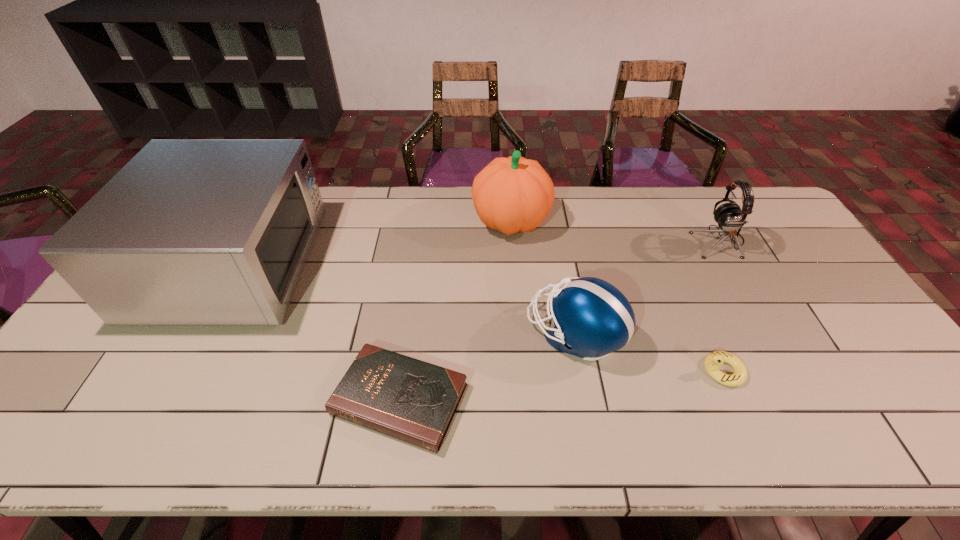
The height and width of the screenshot is (540, 960). What are the coordinates of `vacant area that lies between the second object from left to right and the football helmet` in the screenshot? It's located at (487, 366).

Where is `vacant space that's between the pumpkin and the second object from left to right`? Image resolution: width=960 pixels, height=540 pixels. vacant space that's between the pumpkin and the second object from left to right is located at coordinates (455, 310).

At what (x,y) coordinates should I click in order to perform the action: click on vacant area between the fifth object from right to left and the third shortest object. Please return your answer as a coordinate pair (x, y). Looking at the image, I should click on (487, 366).

Where is `free space that is in between the leftmost object and the fourth tallest object`? free space that is in between the leftmost object and the fourth tallest object is located at coordinates (404, 299).

Find the location of a particular element. The image size is (960, 540). empty location between the third tallest object and the fourth tallest object is located at coordinates (647, 287).

You are a GUI agent. You are given a task and a screenshot of the screen. Output one action in this format:
    pyautogui.click(x=<x>, y=<y>)
    Task: Click on the free point between the pumpkin and the second object from left to right
    The height and width of the screenshot is (540, 960).
    Given the screenshot: What is the action you would take?
    pyautogui.click(x=455, y=310)

Select which object is the fifth closest to the shortest object. Please provide its 2D coordinates. Your answer should be formatted as a tuple, i.e. [(x, y)], where the tuple contains the x and y coordinates of a point satisfying the conditions above.

[(729, 216)]

Find the location of `object that is the fourth closest to the pumpkin`. object that is the fourth closest to the pumpkin is located at coordinates (189, 232).

Where is `vacant space that satisfies the following two spatial constraints: 1. with the door open on the leftmost object; 2. on the back side of the Bible`? The width and height of the screenshot is (960, 540). vacant space that satisfies the following two spatial constraints: 1. with the door open on the leftmost object; 2. on the back side of the Bible is located at coordinates (160, 399).

Image resolution: width=960 pixels, height=540 pixels. Identify the location of free space that satisfies the following two spatial constraints: 1. with the door open on the leftmost object; 2. on the back side of the shortest object. (160, 399).